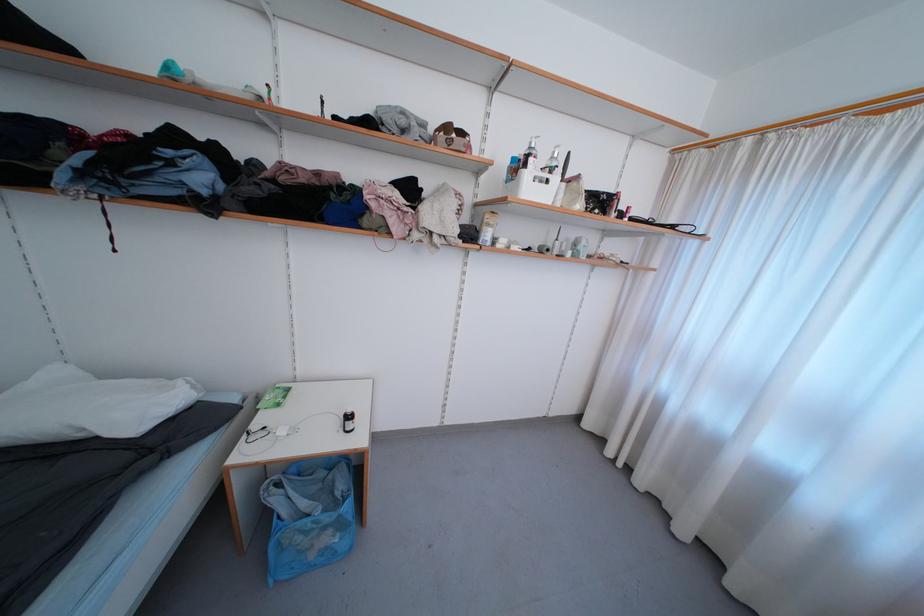
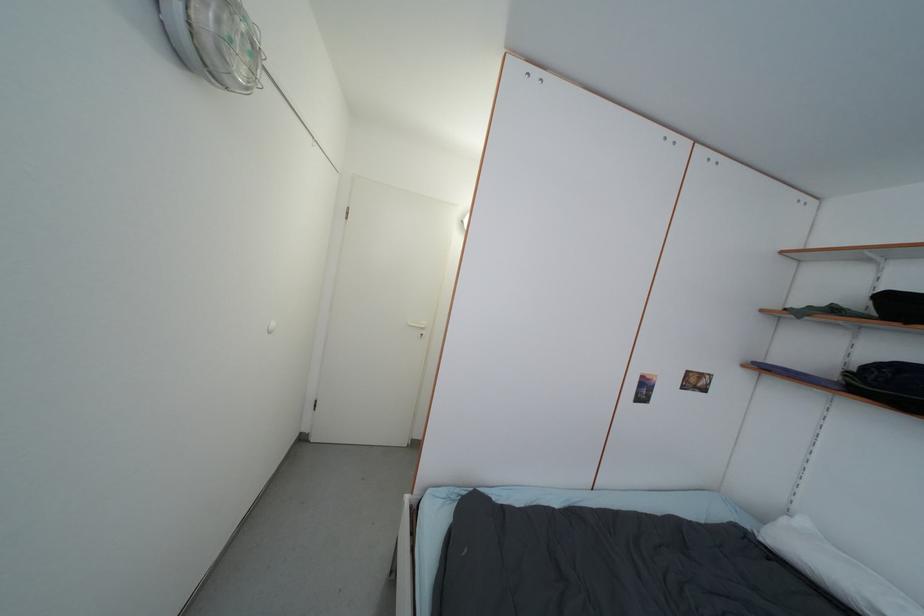
Locate, in the second image, the point that corresponds to (28,445) in the first image.

(812, 576)